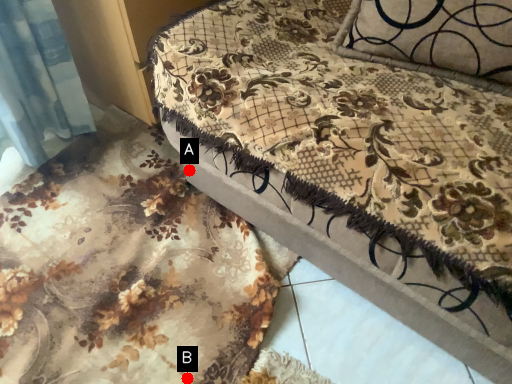
Question: Two points are circled on the image, labeled by A and B beside each circle. Which point is closer to the camera?

Choices:
 (A) A is closer
 (B) B is closer

Answer: (B)